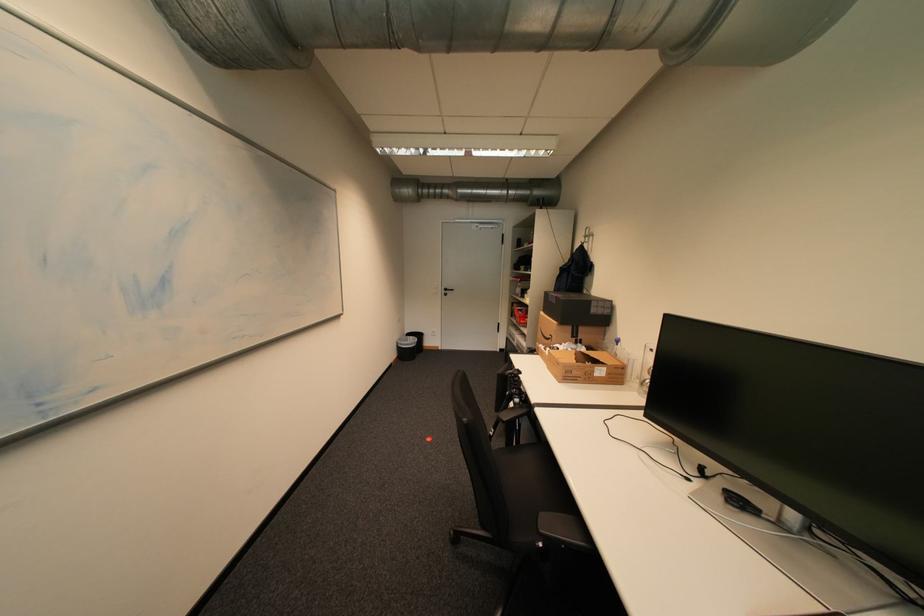
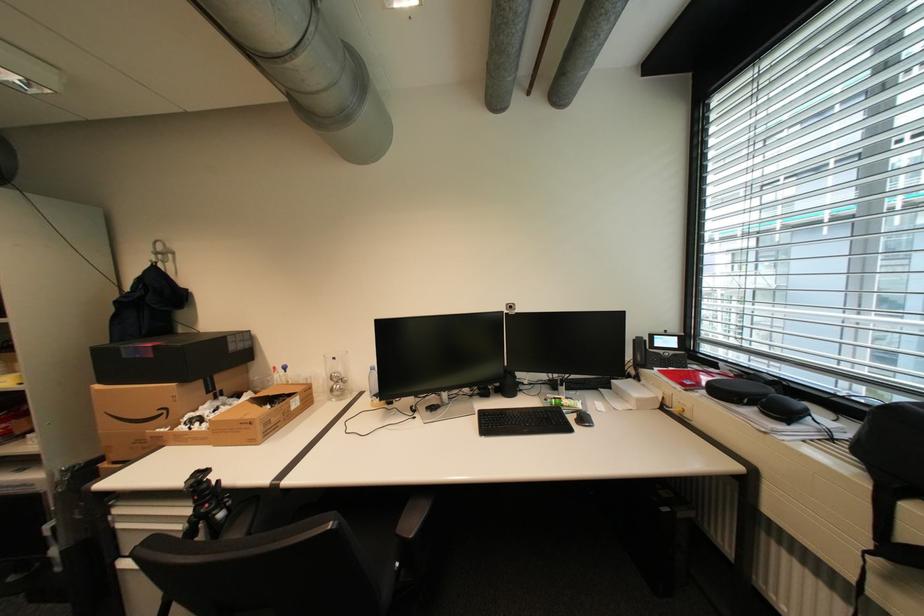
Question: The camera is either moving clockwise (left) or counter-clockwise (right) around the object. The first image is from the beginning of the video and the second image is from the end. Is the camera moving left or right when shooting the video?

Choices:
 (A) Left
 (B) Right

Answer: (A)